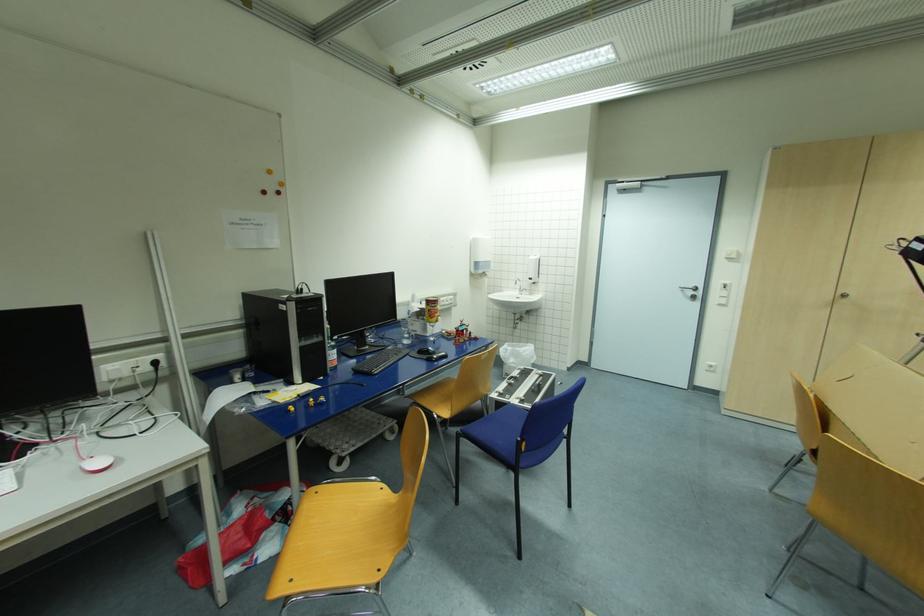
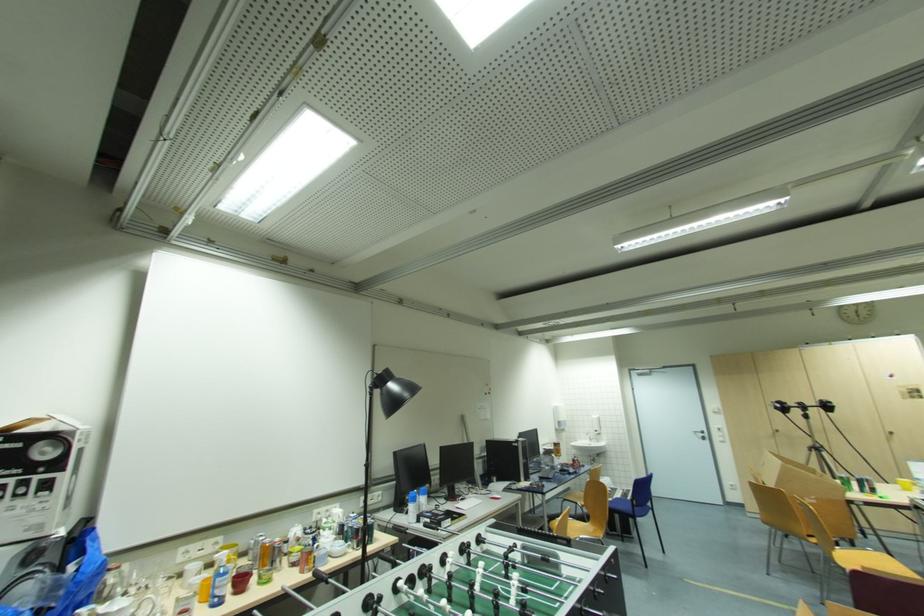
Which direction would the cameraman need to move to produce the second image?

The cameraman walked toward left, backward.